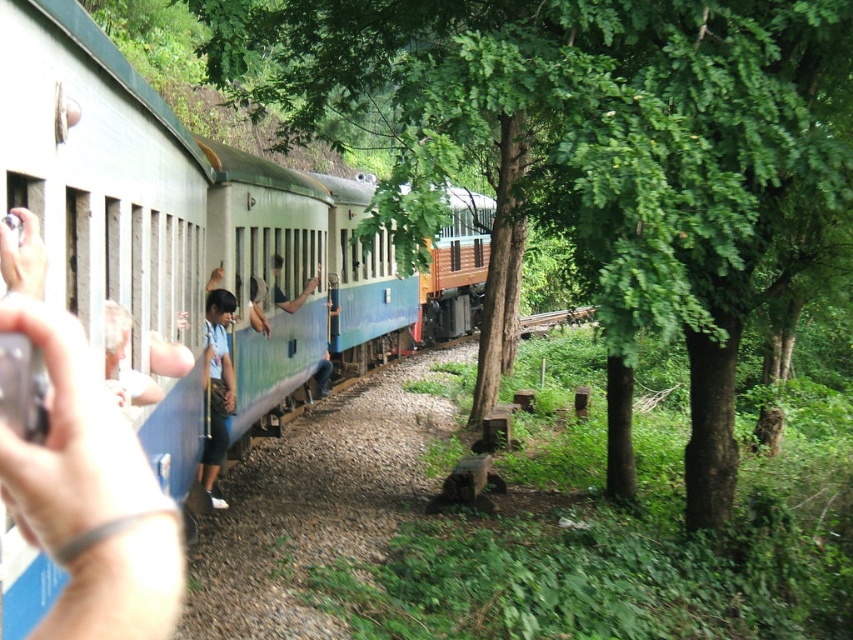
The width and height of the screenshot is (853, 640). Identify the location of green leafy tree at center. (589, 156).

Does green leafy tree at center appear over blue fabric shirt at left?

Correct, green leafy tree at center is located above blue fabric shirt at left.

Does point (575, 33) come closer to viewer compared to point (207, 400)?

Yes, point (575, 33) is in front of point (207, 400).

Locate an element on the screen. green leafy tree at center is located at coordinates pos(589,156).

From the picture: Can you confirm if blue painted metal train at center is taller than blue fabric shirt at left?

Correct, blue painted metal train at center is much taller as blue fabric shirt at left.

Where is `blue painted metal train at center`? The height and width of the screenshot is (640, 853). blue painted metal train at center is located at coordinates (178, 211).

Image resolution: width=853 pixels, height=640 pixels. What do you see at coordinates (178, 211) in the screenshot?
I see `blue painted metal train at center` at bounding box center [178, 211].

The image size is (853, 640). What are the coordinates of `blue painted metal train at center` in the screenshot? It's located at (178, 211).

Does green leafy tree at center appear over blue painted metal train at center?

Yes.

I want to click on green leafy tree at center, so click(589, 156).

Does point (592, 179) come in front of point (6, 198)?

No, it is behind (6, 198).

You are a GUI agent. You are given a task and a screenshot of the screen. Output one action in this format:
    pyautogui.click(x=<x>, y=<y>)
    Task: Click on the green leafy tree at center
    
    Given the screenshot: What is the action you would take?
    pyautogui.click(x=589, y=156)